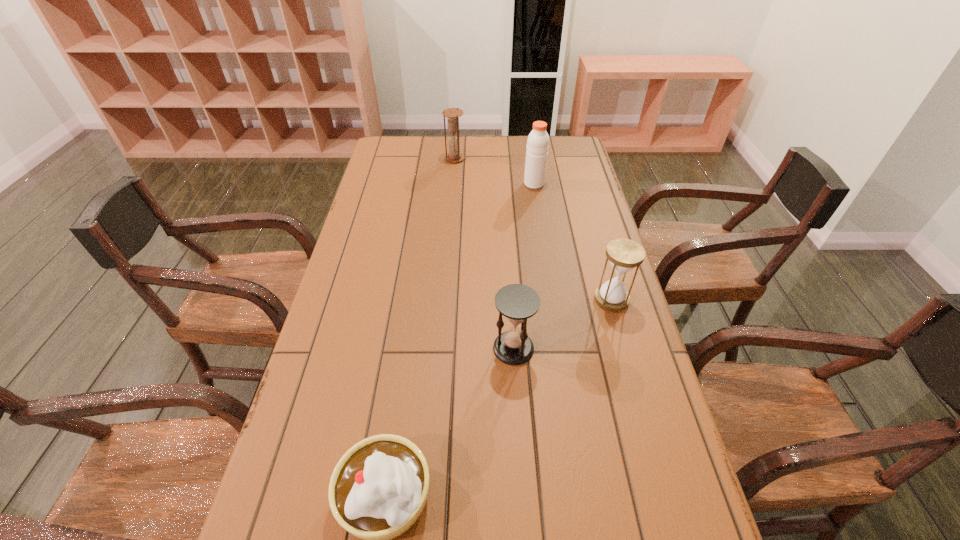
Find the location of `vacant region located 0.310m on the left of the third object from right to left`. vacant region located 0.310m on the left of the third object from right to left is located at coordinates 366,348.

The image size is (960, 540). I want to click on vacant space located on the back of the rightmost hourglass, so click(590, 226).

Where is `object at the far edge`? object at the far edge is located at coordinates (454, 156).

I want to click on object present at the right edge, so click(x=624, y=254).

In the image, there is a desktop. Identify the location of blank space at the far edge. (433, 165).

Identify the location of free region at the left edge of the desktop. (260, 522).

This screenshot has height=540, width=960. I want to click on free space at the right edge of the desktop, so click(x=606, y=246).

Where is `blank space at the far left corner of the desktop`? Image resolution: width=960 pixels, height=540 pixels. blank space at the far left corner of the desktop is located at coordinates (414, 148).

In the image, there is a desktop. Where is `free space at the far right corner`? This screenshot has width=960, height=540. free space at the far right corner is located at coordinates (584, 158).

The image size is (960, 540). Find the location of `free spot between the leftmost hourglass and the second hourglass from left to right`. free spot between the leftmost hourglass and the second hourglass from left to right is located at coordinates (484, 253).